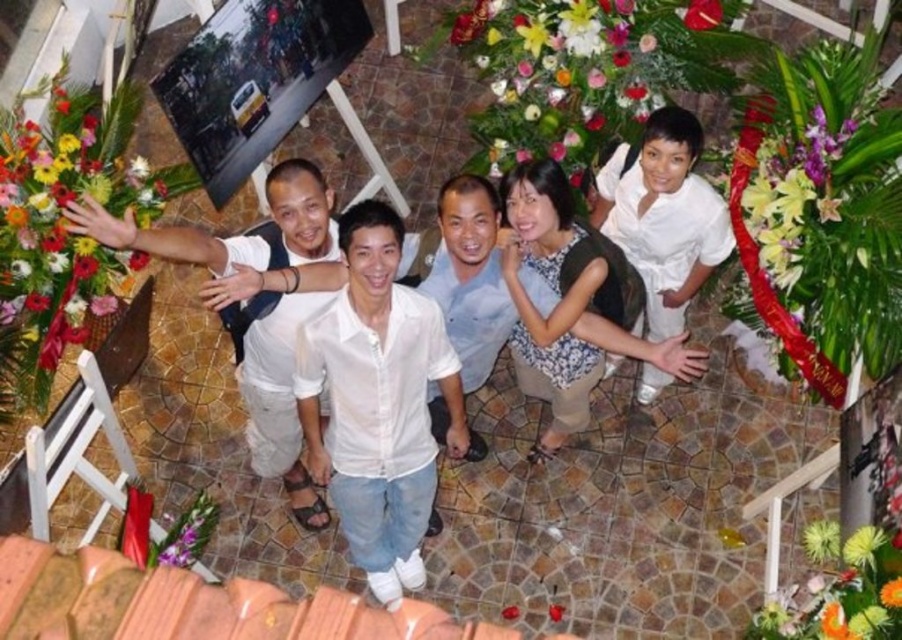
Does floral arrangement at upper center have a lesser width compared to purple silk flower at upper right?

Incorrect, floral arrangement at upper center's width is not less than purple silk flower at upper right's.

Where is `floral arrangement at upper center`? This screenshot has width=902, height=640. floral arrangement at upper center is located at coordinates (584, 68).

Who is positioned more to the right, floral arrangement at upper center or dark green fabric dress at center?

From the viewer's perspective, floral arrangement at upper center appears more on the right side.

Between floral arrangement at upper center and dark green fabric dress at center, which one appears on the left side from the viewer's perspective?

dark green fabric dress at center

Measure the distance between point (x=537, y=68) and camera.

A distance of 5.01 meters exists between point (x=537, y=68) and camera.

Locate an element on the screen. Image resolution: width=902 pixels, height=640 pixels. floral arrangement at upper center is located at coordinates (584, 68).

Between floral arrangement at upper center and floral bouquet at left, which one has less height?

With less height is floral arrangement at upper center.

Is floral arrangement at upper center bigger than floral bouquet at left?

Indeed, floral arrangement at upper center has a larger size compared to floral bouquet at left.

Locate an element on the screen. This screenshot has width=902, height=640. floral arrangement at upper center is located at coordinates (584, 68).